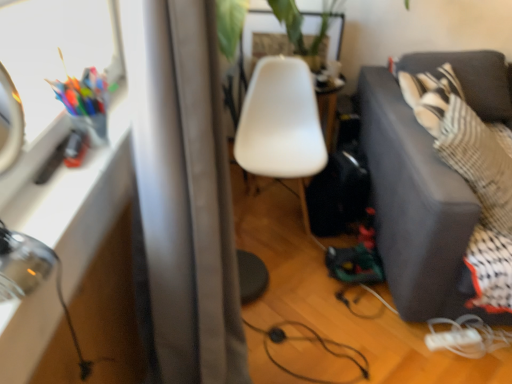
Identify the location of free space below white plastic chair at center (from a real-world perspective). (276, 215).